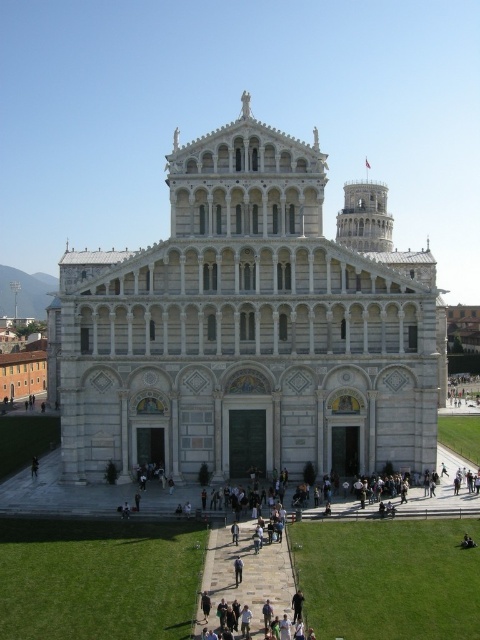
You are a tourist standing at the Piazza dei Miracoli in Pisa. You want to take a photo of the white stone cathedral at center and the dark blue jeans at lower left in the same frame. Which object should you focus on first to ensure both are in the frame?

The white stone cathedral at center might be wider than dark blue jeans at lower left, so you should focus on the white stone cathedral at center first to ensure both are in the frame.

You are standing in the Piazza dei Miracoli and want to take a photo of the white stone cathedral at center. However, there are dark blue jeans at lower left in the way. Can you move around to avoid them while still keeping the cathedral in the frame?

The white stone cathedral at center is closer to the viewer than the dark blue jeans at lower left. Since the cathedral is closer, you can move sideways to position yourself so the cathedral remains in the frame while avoiding the dark blue jeans at lower left.